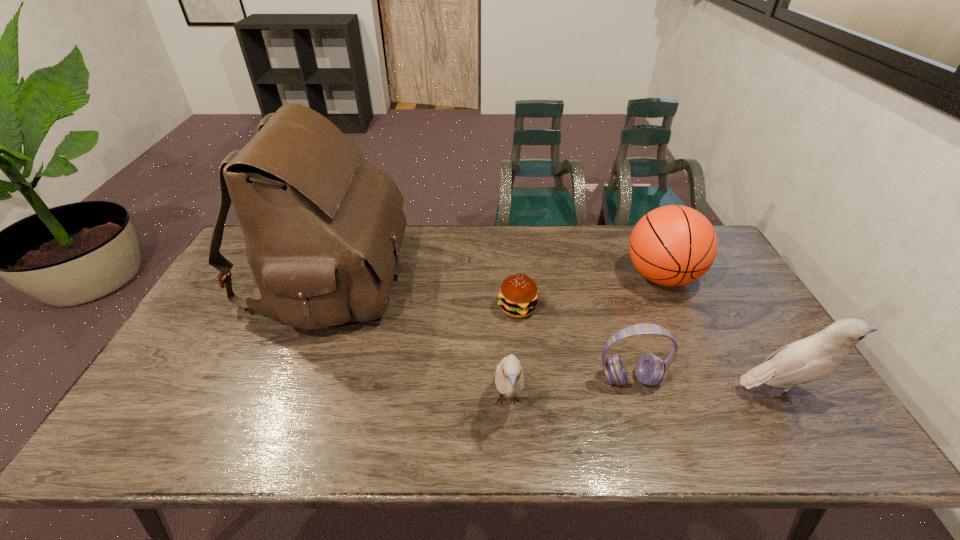
Where is `vacant space at the near edge of the desktop`? The image size is (960, 540). vacant space at the near edge of the desktop is located at coordinates click(x=470, y=410).

At what (x,y) coordinates should I click in order to perform the action: click on free region at the near left corner of the desktop. Please return your answer as a coordinate pair (x, y). Image resolution: width=960 pixels, height=540 pixels. Looking at the image, I should click on (171, 407).

Where is `vacant space in between the leftmost object and the hamburger`? The height and width of the screenshot is (540, 960). vacant space in between the leftmost object and the hamburger is located at coordinates click(x=421, y=293).

I want to click on free space between the right bird and the basketball, so click(721, 334).

You are a GUI agent. You are given a task and a screenshot of the screen. Output one action in this format:
    pyautogui.click(x=<x>, y=<y>)
    Task: Click on the vacant space that is in between the right bird and the shortest object
    
    Given the screenshot: What is the action you would take?
    pyautogui.click(x=649, y=349)

At what (x,y) coordinates should I click in order to perform the action: click on vacant region between the tallest object and the headset. Please return your answer as a coordinate pair (x, y). Image resolution: width=960 pixels, height=540 pixels. Looking at the image, I should click on (478, 328).

This screenshot has width=960, height=540. I want to click on free space between the tallest object and the basketball, so click(493, 277).

Locate an element on the screen. Image resolution: width=960 pixels, height=540 pixels. free spot between the shorter bird and the headset is located at coordinates (569, 390).

Locate an element on the screen. empty space that is in between the basketball and the tallest object is located at coordinates (493, 277).

Find the location of a particular element. This screenshot has height=540, width=960. empty space that is in between the left bird and the right bird is located at coordinates (644, 396).